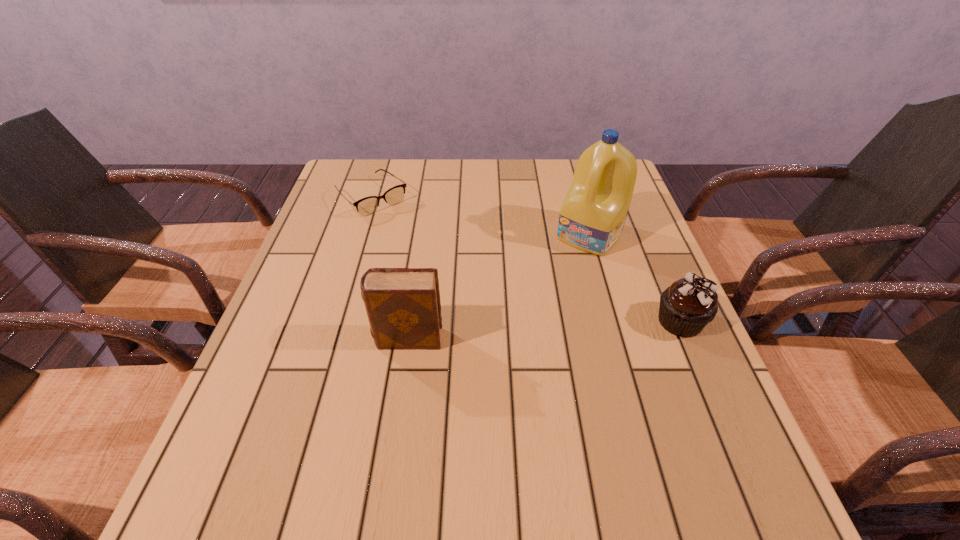
At what (x,y) coordinates should I click in order to perform the action: click on free space that satisfies the following two spatial constraints: 1. on the front side of the spectacles; 2. on the spine side of the diary. Please return your answer as a coordinate pair (x, y). Image resolution: width=960 pixels, height=540 pixels. Looking at the image, I should click on (326, 339).